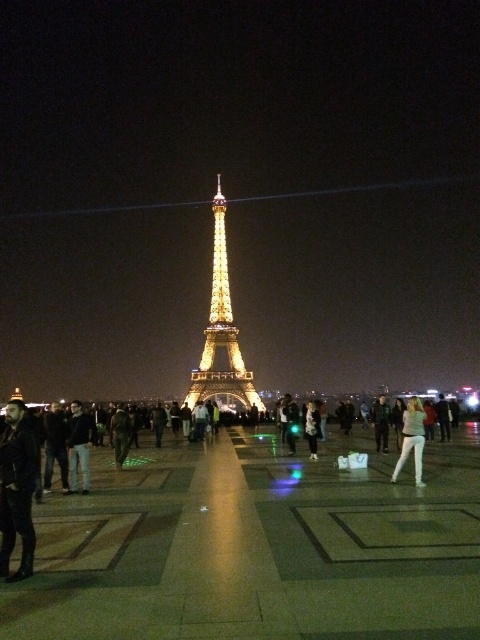
Which is behind, point (2, 449) or point (414, 410)?

Point (414, 410)

In the scene shown: Does dark brown leather jacket at lower left have a greater height compared to white fabric pants at lower right?

Yes.

Which is in front, point (12, 531) or point (414, 419)?

Point (12, 531) is in front.

Where is `dark brown leather jacket at lower left`? This screenshot has width=480, height=640. dark brown leather jacket at lower left is located at coordinates (16, 488).

Which of these two, gold metallic eiffel tower at center or white fabric pants at lower right, stands taller?

gold metallic eiffel tower at center is taller.

Does gold metallic eiffel tower at center have a larger size compared to white fabric pants at lower right?

Yes, gold metallic eiffel tower at center is bigger than white fabric pants at lower right.

The height and width of the screenshot is (640, 480). In order to click on gold metallic eiffel tower at center in this screenshot , I will do `click(222, 332)`.

Which of these two, polished stone plaza at center or white fabric pants at lower right, stands taller?

polished stone plaza at center

Is point (384, 609) closer to camera compared to point (406, 435)?

That is True.

What are the coordinates of `polished stone plaza at center` in the screenshot? It's located at (256, 545).